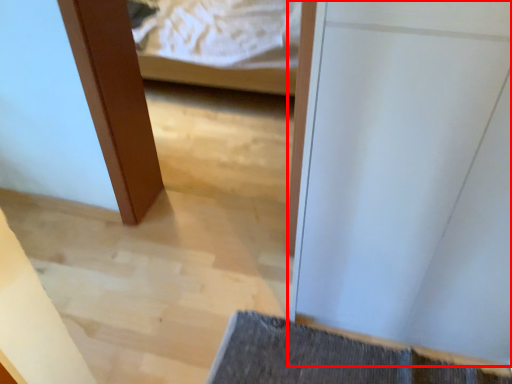
Question: From the image, what is the correct spatial relationship of door (annotated by the red box) in relation to bath mat?

Choices:
 (A) left
 (B) right

Answer: (B)